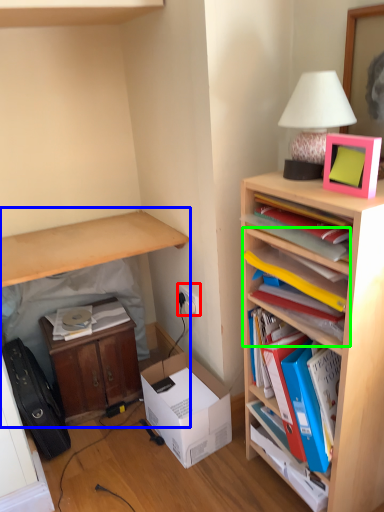
Question: Based on their relative distances, which object is nearer to electric outlet (highlighted by a red box)? Choose from table (highlighted by a blue box) and shelf (highlighted by a green box).

Choices:
 (A) table
 (B) shelf

Answer: (A)